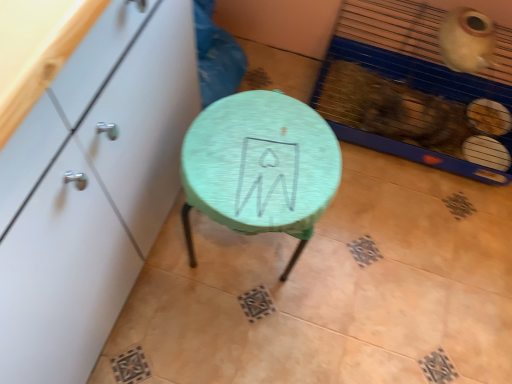
What do you see at coordinates (260, 167) in the screenshot? I see `mint green fabric stool at center` at bounding box center [260, 167].

Identify the location of mint green fabric stool at center. Image resolution: width=512 pixels, height=384 pixels. (260, 167).

Where is `mint green fabric stool at center`? The width and height of the screenshot is (512, 384). mint green fabric stool at center is located at coordinates (260, 167).